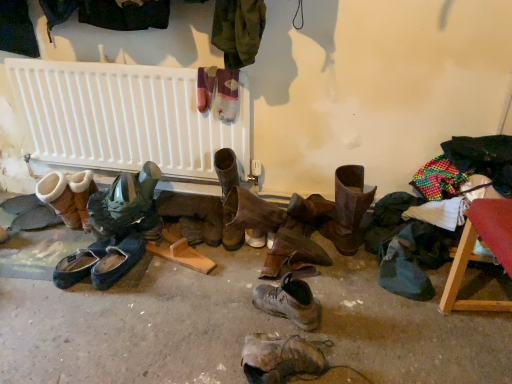
Question: From a real-world perspective, is suede/leather boot at left, which appears as the first footwear when viewed from the left, located beneath leather boot at lower center, acting as the 3th footwear starting from the right?

Choices:
 (A) yes
 (B) no

Answer: (B)

Question: Is suede/leather boot at left, marked as the ninth footwear in a right-to-left arrangement, at the right side of leather boot at lower center, acting as the 3th footwear starting from the right?

Choices:
 (A) yes
 (B) no

Answer: (B)

Question: From a real-world perspective, does suede/leather boot at left, which appears as the first footwear when viewed from the left, stand above leather boot at lower center, the seventh footwear in the left-to-right sequence?

Choices:
 (A) no
 (B) yes

Answer: (B)

Question: From the image's perspective, is suede/leather boot at left, which appears as the first footwear when viewed from the left, on leather boot at lower center, acting as the 3th footwear starting from the right?

Choices:
 (A) no
 (B) yes

Answer: (B)

Question: Does suede/leather boot at left, marked as the ninth footwear in a right-to-left arrangement, have a smaller size compared to leather boot at lower center, acting as the 3th footwear starting from the right?

Choices:
 (A) no
 (B) yes

Answer: (A)

Question: Is point (280, 286) positioned closer to the camera than point (78, 173)?

Choices:
 (A) farther
 (B) closer

Answer: (B)

Question: Is leather boot at center, the 8th footwear in the left-to-right sequence, bigger or smaller than suede/leather boot at left, which appears as the first footwear when viewed from the left?

Choices:
 (A) small
 (B) big

Answer: (A)

Question: Visually, is leather boot at center, which is the 2th footwear in right-to-left order, positioned to the left or to the right of suede/leather boot at left, marked as the ninth footwear in a right-to-left arrangement?

Choices:
 (A) right
 (B) left

Answer: (A)

Question: In terms of width, does leather boot at center, which is the 2th footwear in right-to-left order, look wider or thinner when compared to suede/leather boot at left, marked as the ninth footwear in a right-to-left arrangement?

Choices:
 (A) wide
 (B) thin

Answer: (B)

Question: Is dark blue leather shoes at center, which is counted as the sixth footwear, starting from the right, inside or outside of white plastic radiator at upper center?

Choices:
 (A) inside
 (B) outside

Answer: (B)

Question: Visually, is dark blue leather shoes at center, which is counted as the sixth footwear, starting from the right, positioned to the left or to the right of white plastic radiator at upper center?

Choices:
 (A) right
 (B) left

Answer: (A)

Question: In terms of size, does dark blue leather shoes at center, which is counted as the sixth footwear, starting from the right, appear bigger or smaller than white plastic radiator at upper center?

Choices:
 (A) small
 (B) big

Answer: (A)

Question: Is dark blue leather shoes at center, which appears as the 4th footwear when viewed from the left, wider or thinner than white plastic radiator at upper center?

Choices:
 (A) thin
 (B) wide

Answer: (B)

Question: Considering the positions of white plastic radiator at upper center and dark blue leather shoes at center, which is counted as the sixth footwear, starting from the right, in the image, is white plastic radiator at upper center taller or shorter than dark blue leather shoes at center, which is counted as the sixth footwear, starting from the right,?

Choices:
 (A) tall
 (B) short

Answer: (A)

Question: Is white plastic radiator at upper center in front of or behind dark blue leather shoes at center, which appears as the 4th footwear when viewed from the left, in the image?

Choices:
 (A) front
 (B) behind

Answer: (B)